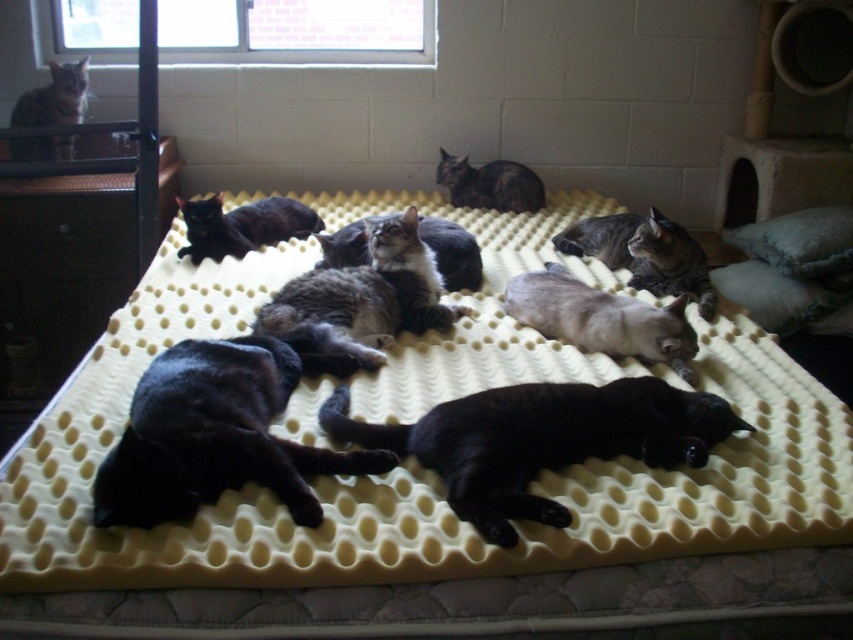
Consider the image. You are a cat owner who wants to place a new toy between the soft gray pillow at right and the black fur cat at center. Since the toy is 20 cm wide, will there be enough space between them?

The soft gray pillow at right is bigger than the black fur cat at center, but the exact distance between them is not provided. Therefore, it is uncertain if the 20 cm wide toy will fit.

You are a cat owner who wants to place a new cat toy on the yellow foam mattress at center. If your cat is currently 3 feet away from the mattress, will it need to walk more than 3 feet to reach the toy?

The yellow foam mattress at center is 37.83 inches away from the viewer. Since 37.83 inches is approximately 3.15 feet, the cat will need to walk slightly more than 3 feet to reach the toy.